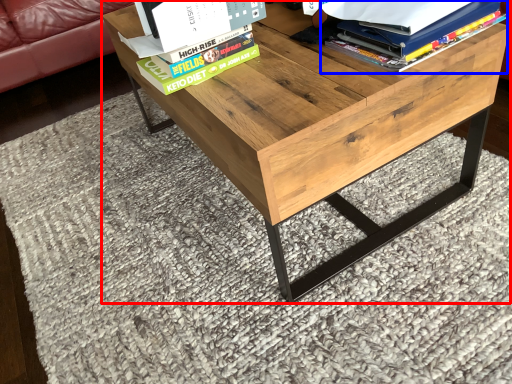
Question: Among these objects, which one is nearest to the camera, table (highlighted by a red box) or book (highlighted by a blue box)?

Choices:
 (A) table
 (B) book

Answer: (A)